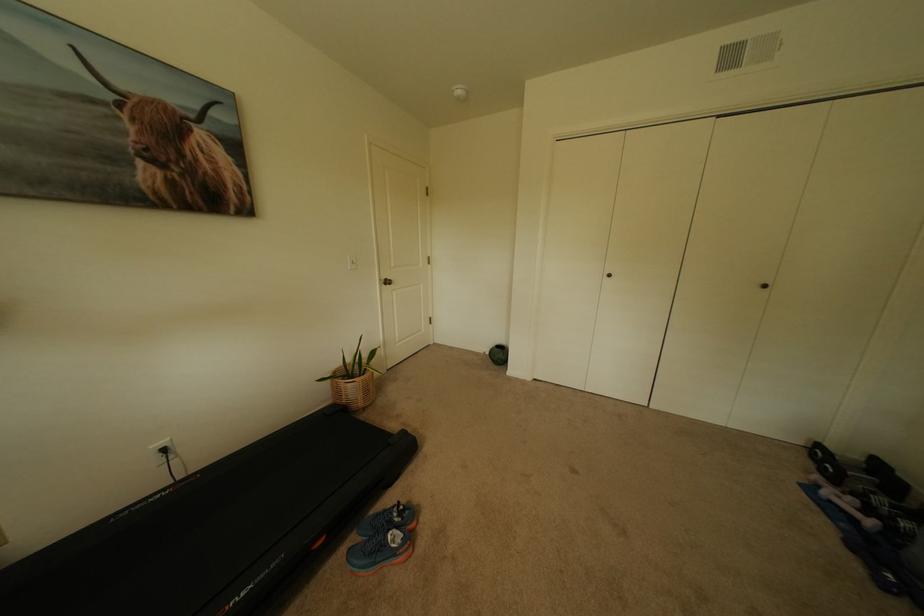
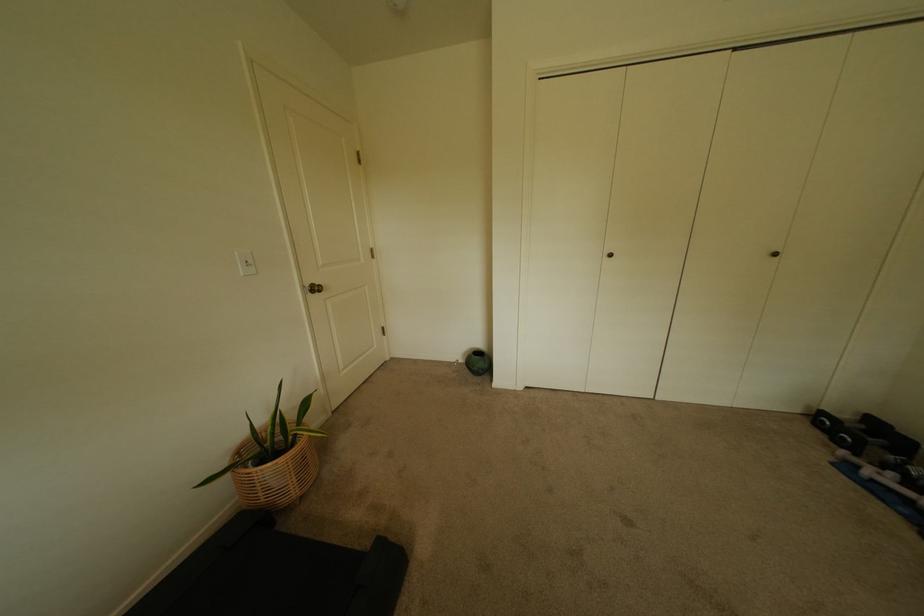
The point at (499, 361) is marked in the first image. Where is the corresponding point in the second image?

(476, 371)